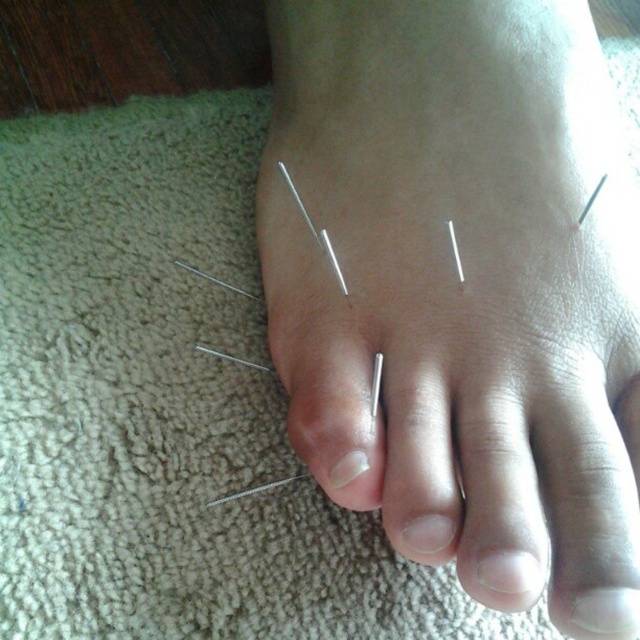
Who is higher up, silver metallic needles at center or white matte nail at center?

Positioned higher is silver metallic needles at center.

Does silver metallic needles at center have a smaller size compared to white matte nail at center?

Incorrect, silver metallic needles at center is not smaller in size than white matte nail at center.

Measure the distance between silver metallic needles at center and camera.

silver metallic needles at center and camera are 13.28 inches apart from each other.

Find the location of a particular element. The height and width of the screenshot is (640, 640). silver metallic needles at center is located at coordinates (465, 355).

Who is positioned more to the right, metallic silver nail at center or white glossy nail at center?

Positioned to the right is metallic silver nail at center.

Is metallic silver nail at center below white glossy nail at center?

Yes, metallic silver nail at center is below white glossy nail at center.

Where is `metallic silver nail at center`? metallic silver nail at center is located at coordinates (429, 532).

Where is `metallic silver nail at center`? metallic silver nail at center is located at coordinates (429, 532).

Which of these two, white matte nail at center or white glossy nail at center, stands taller?

white matte nail at center is taller.

Can you confirm if white matte nail at center is smaller than white glossy nail at center?

Actually, white matte nail at center might be larger than white glossy nail at center.

Is point (524, 579) behind point (362, 464)?

That is False.

I want to click on white matte nail at center, so click(508, 572).